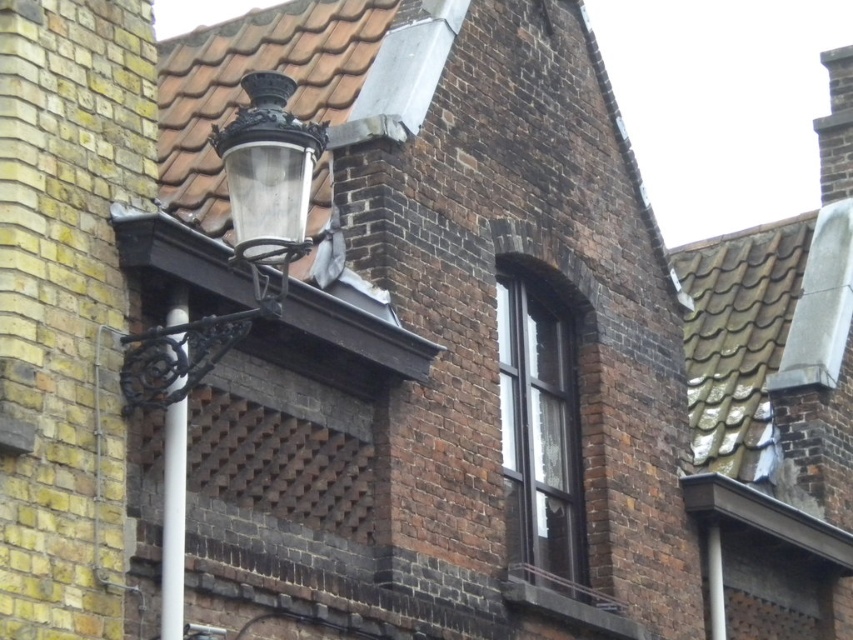
Does black glass window at upper center appear on the left side of white plastic pole at left?

In fact, black glass window at upper center is to the right of white plastic pole at left.

The image size is (853, 640). Identify the location of black glass window at upper center. (538, 433).

This screenshot has width=853, height=640. Find the location of `black glass window at upper center`. black glass window at upper center is located at coordinates (538, 433).

Find the location of `black glass window at upper center`. black glass window at upper center is located at coordinates (538, 433).

Locate an element on the screen. This screenshot has width=853, height=640. polished brass lamp post at upper left is located at coordinates (230, 312).

The height and width of the screenshot is (640, 853). What do you see at coordinates (230, 312) in the screenshot?
I see `polished brass lamp post at upper left` at bounding box center [230, 312].

Find the location of a particular element. The width and height of the screenshot is (853, 640). polished brass lamp post at upper left is located at coordinates (230, 312).

Is polished brass lamp post at upper left smaller than white plastic pole at left?

Incorrect, polished brass lamp post at upper left is not smaller in size than white plastic pole at left.

Does point (254, 156) lie behind point (178, 486)?

No, (254, 156) is in front of (178, 486).

I want to click on polished brass lamp post at upper left, so (x=230, y=312).